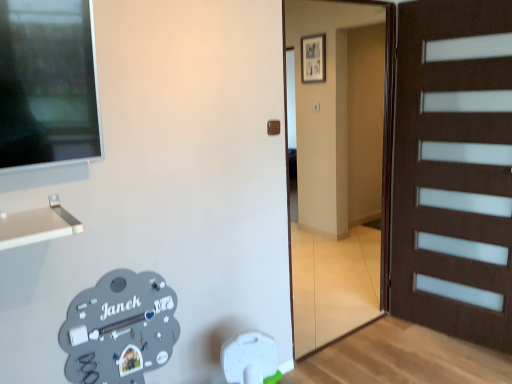
Question: Is brown matte door handle at center situated inside brown wooden door at center or outside?

Choices:
 (A) inside
 (B) outside

Answer: (B)

Question: Is brown matte door handle at center bigger or smaller than brown wooden door at center?

Choices:
 (A) big
 (B) small

Answer: (B)

Question: In the image, is brown matte door handle at center on the left side or the right side of brown wooden door at center?

Choices:
 (A) right
 (B) left

Answer: (B)

Question: In terms of width, does brown wooden door at center look wider or thinner when compared to brown matte door handle at center?

Choices:
 (A) wide
 (B) thin

Answer: (A)

Question: In the image, is brown wooden door at center positioned in front of or behind brown matte door handle at center?

Choices:
 (A) behind
 (B) front

Answer: (B)

Question: In the image, is brown wooden door at center on the left side or the right side of brown matte door handle at center?

Choices:
 (A) left
 (B) right

Answer: (B)

Question: From a real-world perspective, is brown wooden door at center physically located above or below brown matte door handle at center?

Choices:
 (A) above
 (B) below

Answer: (B)